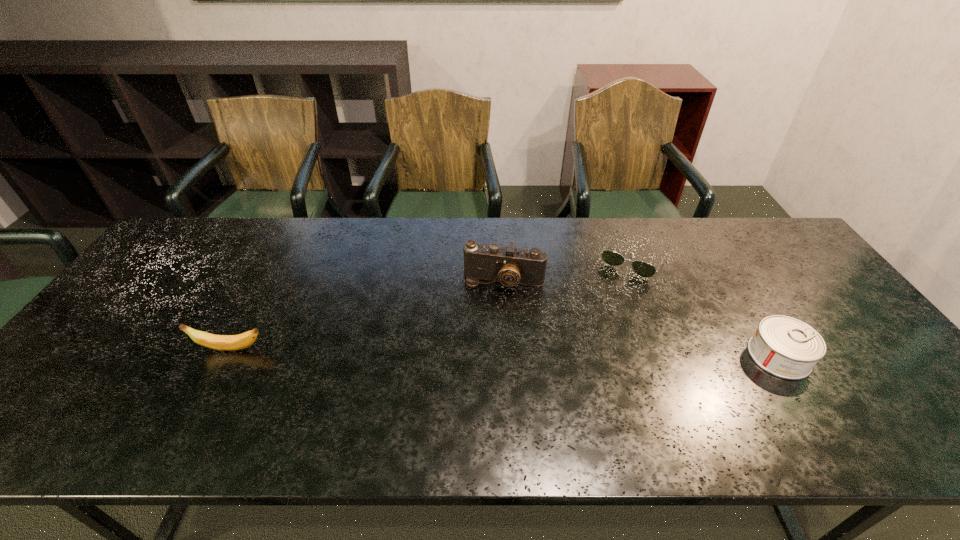
In the image, there is a desktop. Identify the location of vacant space at the far edge. pos(576,258).

This screenshot has width=960, height=540. In the image, there is a desktop. In order to click on free space at the near edge in this screenshot , I will do `click(168, 387)`.

Where is `vacant space at the left edge of the desktop`? This screenshot has height=540, width=960. vacant space at the left edge of the desktop is located at coordinates (106, 363).

The height and width of the screenshot is (540, 960). I want to click on vacant area at the right edge of the desktop, so click(x=762, y=268).

In the image, there is a desktop. Where is `vacant space at the far left corner`? This screenshot has height=540, width=960. vacant space at the far left corner is located at coordinates (174, 253).

Identify the location of vacant space at the far right corner. (773, 224).

Find the location of a particular element. The height and width of the screenshot is (540, 960). vacant area that lies between the tallest object and the banana is located at coordinates (367, 315).

Locate an element on the screen. The image size is (960, 540). free space between the rightmost object and the second tallest object is located at coordinates (505, 353).

Find the location of a particular element. vacant region between the tallest object and the sunglasses is located at coordinates (569, 269).

Find the location of `free space between the can and the third object from left to right`. free space between the can and the third object from left to right is located at coordinates (707, 307).